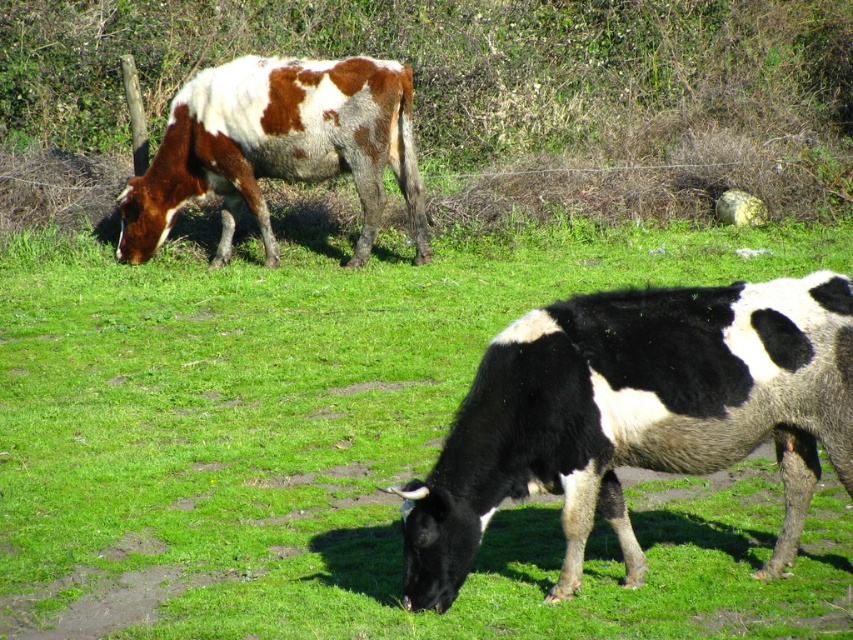
You are a farmer checking the field. You notice the black and white cow at center and the brown spotted fur at upper left. Which cow is wider?

The black and white cow at center is wider than the brown spotted fur at upper left.

You are a farmer checking the fence line. You notice the black and white cow at center and the brown spotted fur at upper left. Which cow is closer to the fence that runs horizontally across the middle of the image?

The black and white cow at center is closer to the fence because it is positioned in front of the brown spotted fur at upper left, which is farther away from the fence.

You are a farmer who needs to separate the black and white cow at center and the black and white fur at lower right with a fence. The fence you have is 3 meters long. Will it be sufficient to place the fence between them?

The distance between the black and white cow at center and the black and white fur at lower right is 2.73 meters. Since the fence is 3 meters long, it will be sufficient to place the fence between them as it is longer than the required distance.